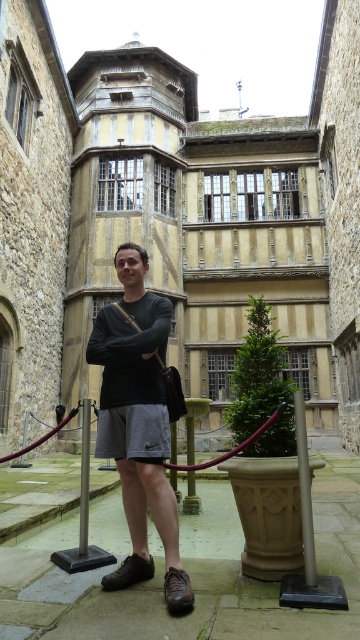
Does black sweater at center appear on the right side of brown polished pole at center?

In fact, black sweater at center is to the left of brown polished pole at center.

Which is more to the right, black sweater at center or brown polished pole at center?

brown polished pole at center

The width and height of the screenshot is (360, 640). Identify the location of black sweater at center. pos(129,332).

Is wooden balcony at center wider than brown polished pole at center?

Indeed, wooden balcony at center has a greater width compared to brown polished pole at center.

You are a GUI agent. You are given a task and a screenshot of the screen. Output one action in this format:
    pyautogui.click(x=<x>, y=<y>)
    Task: Click on the wooden balcony at center
    This screenshot has width=360, height=640.
    Given the screenshot: What is the action you would take?
    pyautogui.click(x=176, y=220)

Can you confirm if wooden balcony at center is positioned to the left of black sweater at center?

No, wooden balcony at center is not to the left of black sweater at center.

Which is more to the right, wooden balcony at center or black sweater at center?

wooden balcony at center

Identify the location of wooden balcony at center. This screenshot has width=360, height=640. (176, 220).